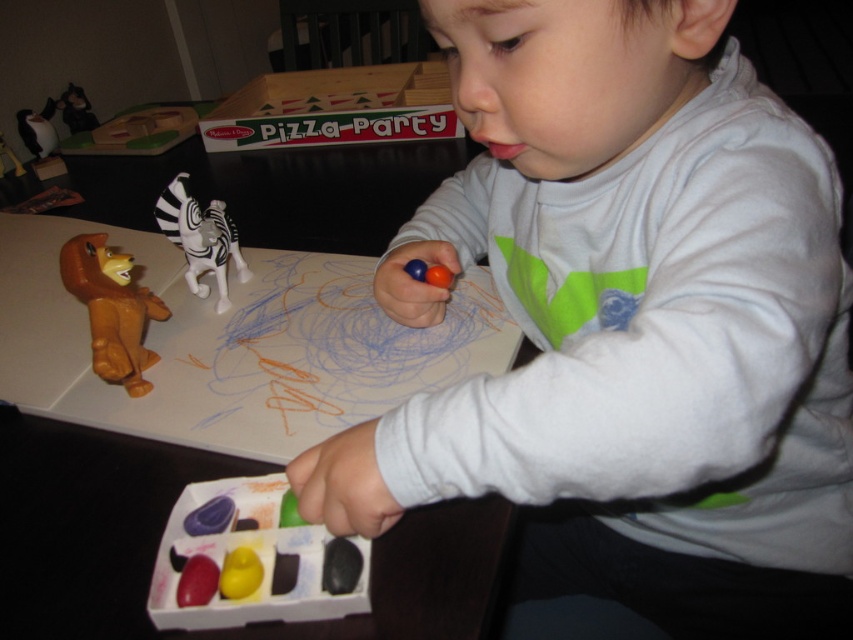
Does wooden pizza party box at center have a lesser height compared to brown rubber lion at left?

No.

Is wooden pizza party box at center to the right of brown rubber lion at left from the viewer's perspective?

Correct, you'll find wooden pizza party box at center to the right of brown rubber lion at left.

Find the location of a particular element. wooden pizza party box at center is located at coordinates (335, 108).

Who is shorter, brown rubber lion at left or white plastic zebra at center-left?

white plastic zebra at center-left is shorter.

Who is more distant from viewer, (93,355) or (172,237)?

The point (172,237) is more distant.

In order to click on brown rubber lion at left in this screenshot , I will do `click(111, 308)`.

Who is taller, smooth plastic crayons at lower center or brown rubber lion at left?

brown rubber lion at left is taller.

Which is more to the right, smooth plastic crayons at lower center or brown rubber lion at left?

Positioned to the right is smooth plastic crayons at lower center.

Find the location of a particular element. smooth plastic crayons at lower center is located at coordinates (254, 557).